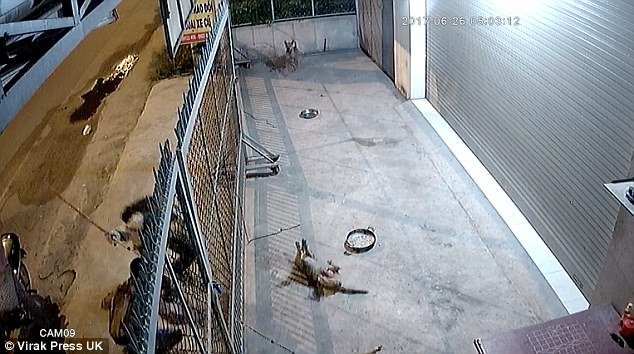
The width and height of the screenshot is (634, 354). Find the location of `concrete floor`. concrete floor is located at coordinates (391, 190).